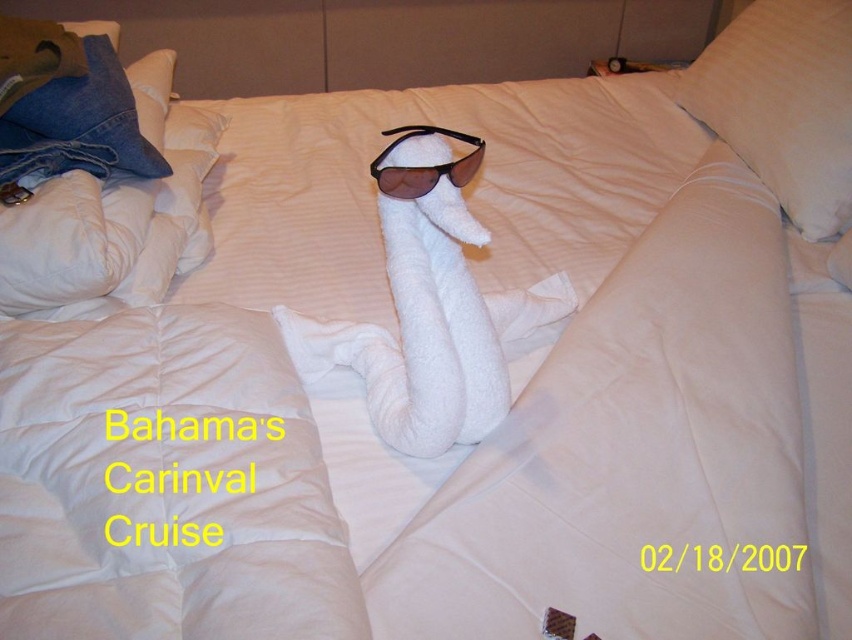
You are organizing a small party in your bedroom and need to place a 12 inch long decorative item between the denim fabric pillow at upper left and the dark brown plastic sunglasses at center. Is there enough space to place it without moving either item?

The denim fabric pillow at upper left is 21.76 inches away from the dark brown plastic sunglasses at center. Since the decorative item is only 12 inches long, there is sufficient space to place it between them without moving either item.

You are organizing a room and need to retrieve the dark brown plastic sunglasses at center. However, there is a denim fabric pillow at upper left blocking access to them. Can you remove the pillow to get the sunglasses?

The denim fabric pillow at upper left is positioned over dark brown plastic sunglasses at center, so you can remove the pillow to access the sunglasses.